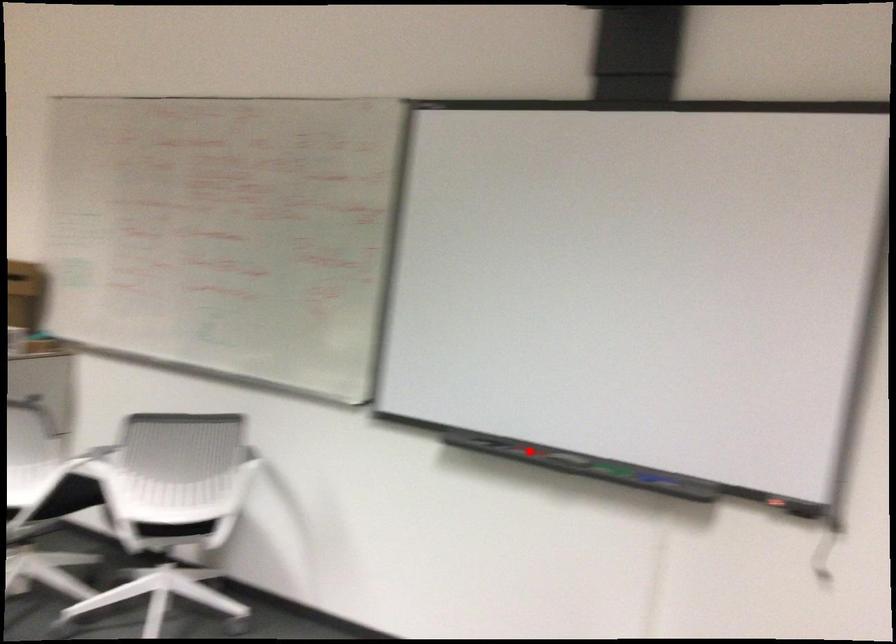
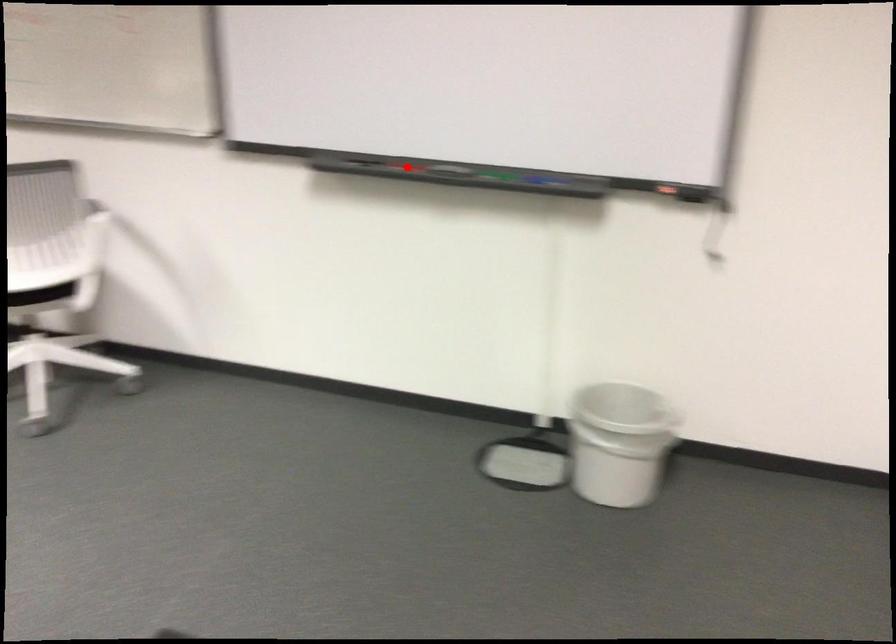
I am providing you with two images of the same scene from different viewpoints. A red point is marked on the first image and another point is marked on the second image. Is the marked point in image1 the same physical position as the marked point in image2?

Yes